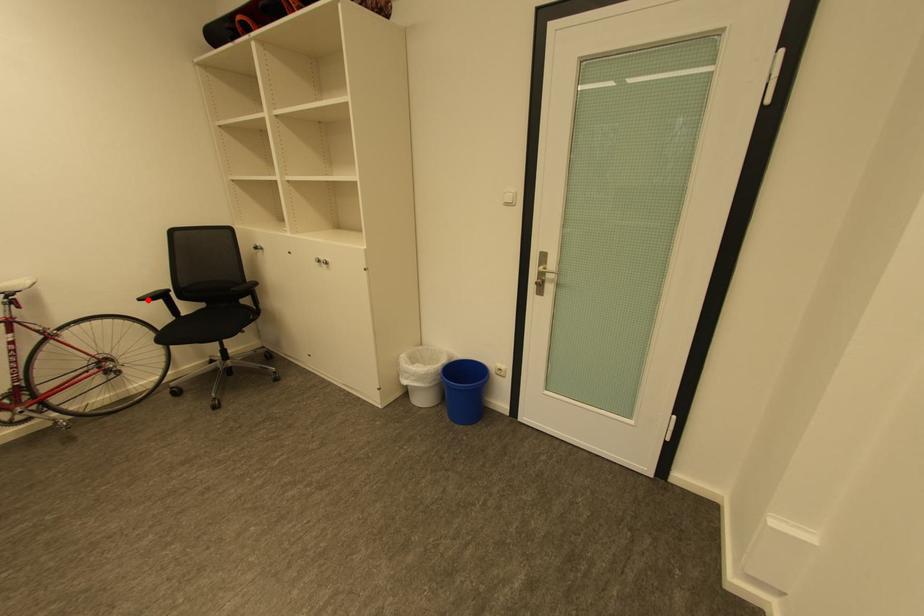
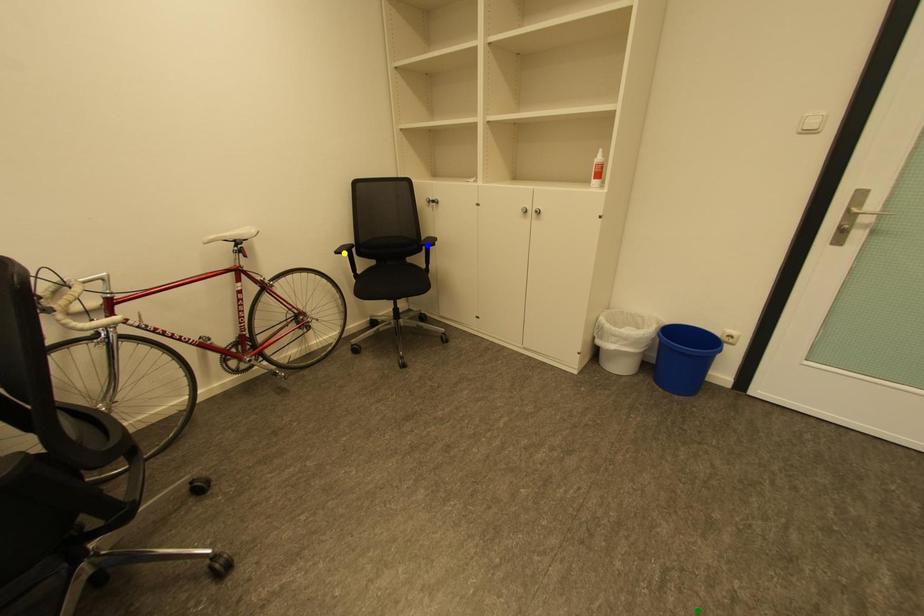
Question: I am providing you with two images of the same scene from different viewpoints. A red point is marked on the first image. You are given multiple points on the second image. Can you choose the point in image 2 that corresponds to the point in image 1?

Choices:
 (A) yellow point
 (B) blue point
 (C) green point

Answer: (A)